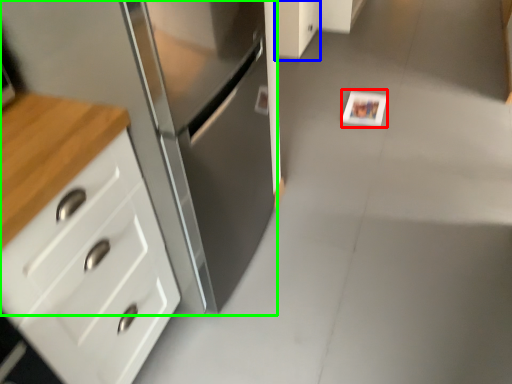
Question: Which object is positioned farthest from postcard (highlighted by a red box)? Select from cabinetry (highlighted by a blue box) and cabinetry (highlighted by a green box).

Choices:
 (A) cabinetry
 (B) cabinetry

Answer: (B)